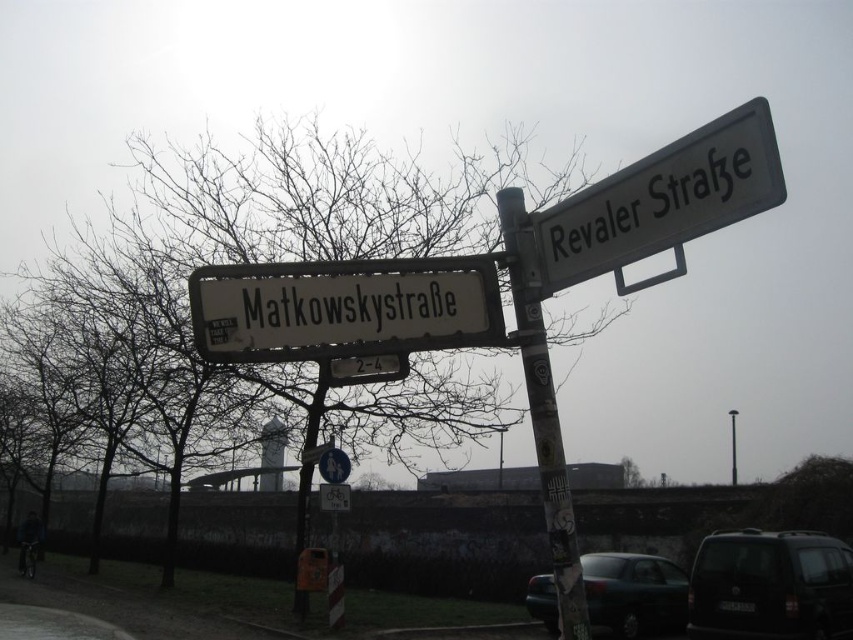
Who is positioned more to the right, stained wood pole at upper center or metallic pole at upper center?

From the viewer's perspective, metallic pole at upper center appears more on the right side.

Where is `stained wood pole at upper center`? The image size is (853, 640). stained wood pole at upper center is located at coordinates (543, 412).

The image size is (853, 640). I want to click on stained wood pole at upper center, so click(543, 412).

Does white plastic street sign at upper right have a lesser width compared to metallic pole at center?

Indeed, white plastic street sign at upper right has a lesser width compared to metallic pole at center.

Does white plastic street sign at upper right have a greater width compared to metallic pole at center?

Incorrect, white plastic street sign at upper right's width does not surpass metallic pole at center's.

I want to click on white plastic street sign at upper right, so click(x=663, y=202).

Where is `white plastic street sign at upper right`? white plastic street sign at upper right is located at coordinates (663, 202).

Is stained wood pole at upper center smaller than metallic pole at center?

Correct, stained wood pole at upper center occupies less space than metallic pole at center.

Is stained wood pole at upper center above metallic pole at center?

Yes.

Does point (534, 269) lie behind point (305, 440)?

No, it is in front of (305, 440).

This screenshot has height=640, width=853. I want to click on stained wood pole at upper center, so click(543, 412).